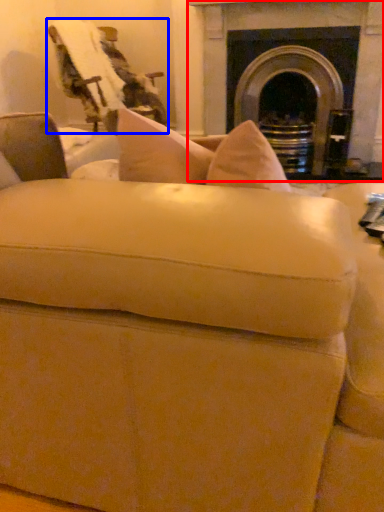
Question: Which object appears farthest to the camera in this image, fireplace (highlighted by a red box) or swivel chair (highlighted by a blue box)?

Choices:
 (A) fireplace
 (B) swivel chair

Answer: (A)